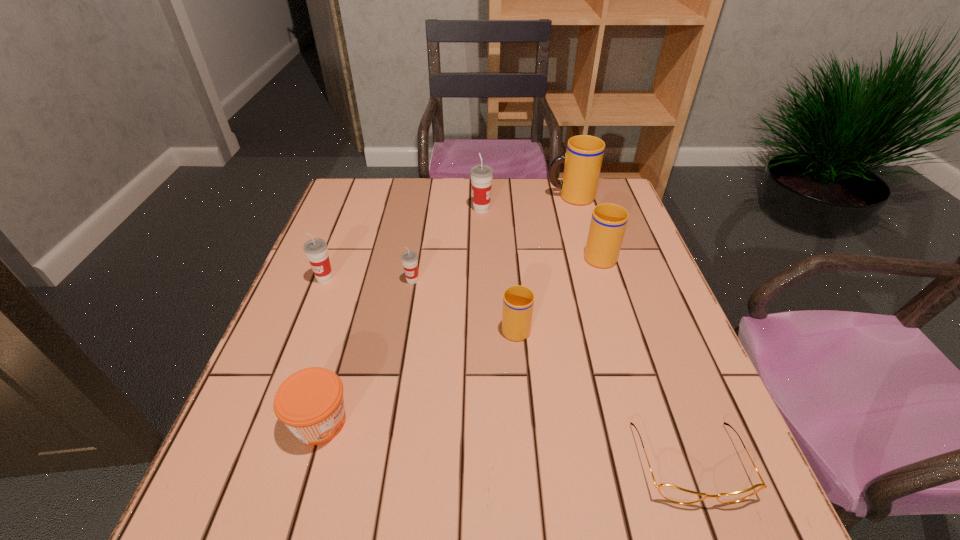
The height and width of the screenshot is (540, 960). What are the coordinates of `cup present at the left edge` in the screenshot? It's located at (316, 250).

At what (x,y) coordinates should I click in order to perform the action: click on jam that is positioned at the left edge. Please return your answer as a coordinate pair (x, y). Looking at the image, I should click on (310, 402).

What are the coordinates of `spectacles at the right edge` in the screenshot? It's located at (672, 493).

You are a GUI agent. You are given a task and a screenshot of the screen. Output one action in this format:
    pyautogui.click(x=<x>, y=<y>)
    Task: Click on the object that is positioned at the far right corner
    This screenshot has height=540, width=960.
    Given the screenshot: What is the action you would take?
    pyautogui.click(x=582, y=161)

The image size is (960, 540). Identify the location of object that is at the near right corner. (672, 493).

Locate an element on the screen. This screenshot has height=540, width=960. vacant area at the far edge is located at coordinates (412, 187).

In the image, there is a desktop. Identify the location of vacant space at the near edge. (339, 534).

In the image, there is a desktop. Identify the location of vacant space at the left edge. This screenshot has height=540, width=960. (330, 264).

The image size is (960, 540). Identify the location of vacant position at the right edge of the desktop. (594, 267).

You are a GUI agent. You are given a task and a screenshot of the screen. Output one action in this format:
    pyautogui.click(x=<x>, y=<y>)
    Task: Click on the free space at the far left corner
    The height and width of the screenshot is (540, 960).
    Given the screenshot: What is the action you would take?
    pyautogui.click(x=374, y=194)